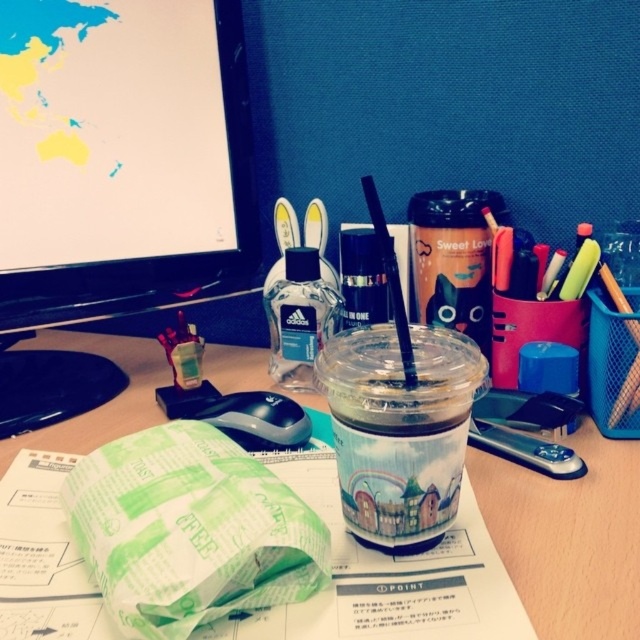
Between translucent plastic bottle at center and transparent plastic straw at center, which one appears on the right side from the viewer's perspective?

Positioned to the right is transparent plastic straw at center.

Is translucent plastic bottle at center thinner than transparent plastic straw at center?

In fact, translucent plastic bottle at center might be wider than transparent plastic straw at center.

Find the location of a particular element. The image size is (640, 640). translucent plastic bottle at center is located at coordinates (300, 317).

The width and height of the screenshot is (640, 640). I want to click on translucent plastic bottle at center, so click(300, 317).

Who is lower down, wooden desk at center or transparent plastic straw at center?

wooden desk at center is below.

The height and width of the screenshot is (640, 640). What are the coordinates of `wooden desk at center` in the screenshot? It's located at (570, 538).

Can you confirm if matte black canister at center is positioned to the right of transparent plastic straw at center?

Correct, you'll find matte black canister at center to the right of transparent plastic straw at center.

Is point (474, 212) more distant than point (413, 381)?

Yes, it is.

Find the location of a particular element. matte black canister at center is located at coordinates (452, 260).

Identify the location of matte black canister at center. Image resolution: width=640 pixels, height=640 pixels. (452, 260).